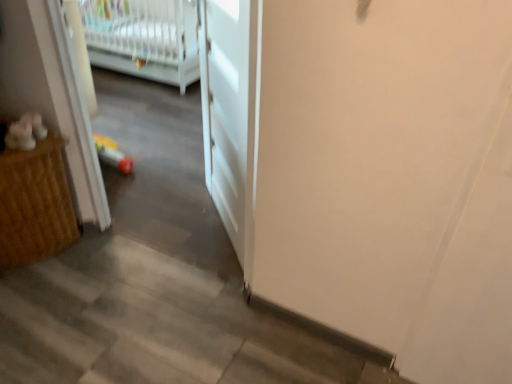
Question: Considering the positions of point (225, 44) and point (195, 23), is point (225, 44) closer or farther from the camera than point (195, 23)?

Choices:
 (A) farther
 (B) closer

Answer: (B)

Question: Is white matte door at center taller or shorter than white plastic infant bed at upper left?

Choices:
 (A) tall
 (B) short

Answer: (A)

Question: Which object is positioned farthest from the white plastic infant bed at upper left?

Choices:
 (A) wooden cabinet at left
 (B) white matte door at center

Answer: (A)

Question: Which of these objects is positioned farthest from the wooden cabinet at left?

Choices:
 (A) white plastic infant bed at upper left
 (B) white matte door at center

Answer: (A)